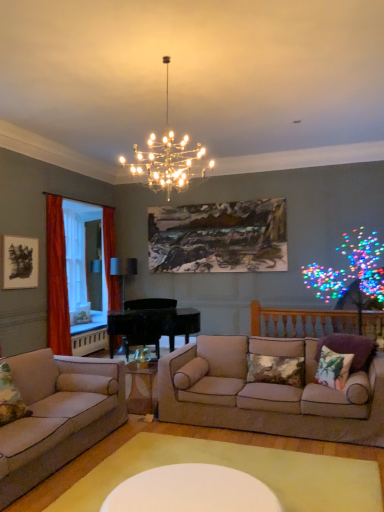
Question: From the image's perspective, is textured beige pillow at center, which appears as the first pillow when viewed from the left, positioned above or below translucent fabric curtain at left, positioned as the 2th window screen in back-to-front order?

Choices:
 (A) below
 (B) above

Answer: (A)

Question: From a real-world perspective, is textured beige pillow at center, acting as the third pillow starting from the right, positioned above or below translucent fabric curtain at left, the 1th window screen when ordered from front to back?

Choices:
 (A) below
 (B) above

Answer: (A)

Question: Estimate the real-world distances between objects in this image. Which object is farther from the textured beige pillow at center, which appears as the first pillow when viewed from the left?

Choices:
 (A) black matte picture frame at upper left, the second picture frame viewed from the right
 (B) matte black lamp at center, placed as the first lamp when sorted from bottom to top
 (C) beige fabric couch at center, which ranks as the first studio couch in right-to-left order
 (D) beige fabric couch at lower left, which ranks as the 1th studio couch in left-to-right order
 (E) velvet orange curtain at left, which is the first curtain from left to right

Answer: (B)

Question: Estimate the real-world distances between objects in this image. Which object is closer to the clear glass window screen at left, arranged as the 1th window screen when viewed from the back?

Choices:
 (A) metallic chandelier at upper center, positioned as the 2th lamp in back-to-front order
 (B) beige fabric couch at center, marked as the 2th studio couch in a left-to-right arrangement
 (C) velvet orange curtain at left, which appears as the second curtain when viewed from the back
 (D) black matte picture frame at upper left, the 1th picture frame from the left
 (E) beige fabric couch at lower left, which ranks as the 1th studio couch in left-to-right order

Answer: (C)